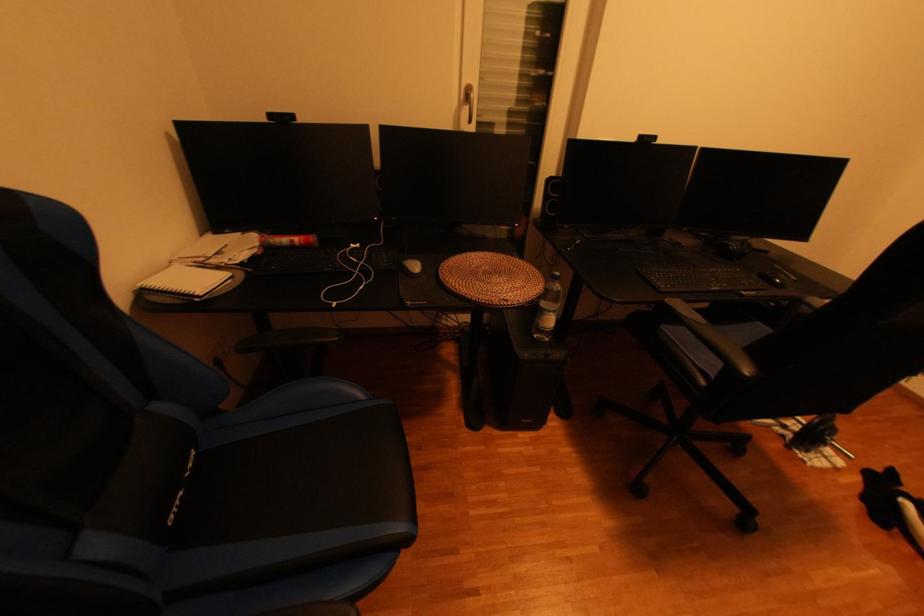
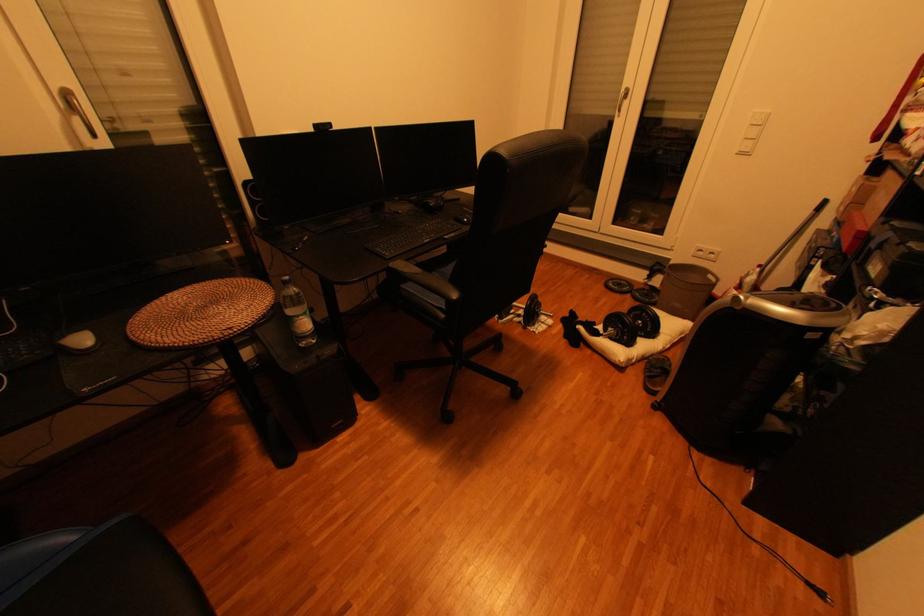
In the second image, find the point that corresponds to pixel 561 314 in the first image.

(310, 318)